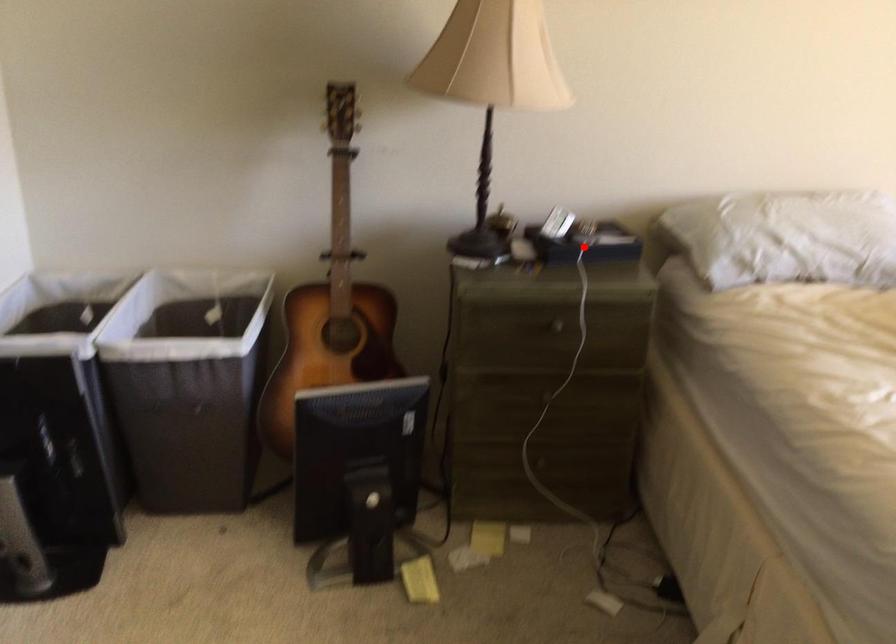
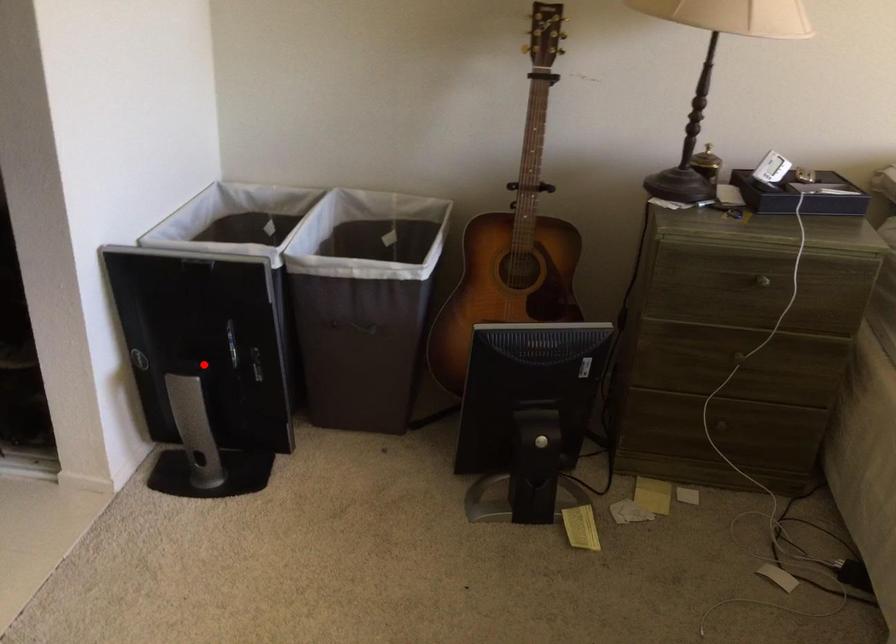
I am providing you with two images of the same scene from different viewpoints. A red point is marked on the first image and another point is marked on the second image. Is the red point in image1 aligned with the point shown in image2?

No